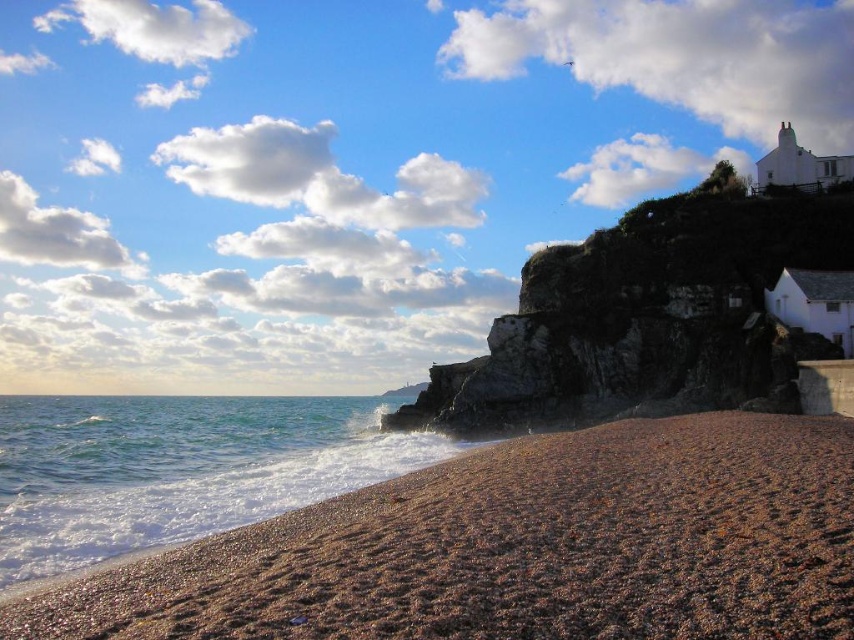
In the scene shown: You are standing on the pebble beach and want to climb up to the rugged stone cliff at upper right. The clear water at lower left is nearby. Which object is higher in elevation?

The rugged stone cliff at upper right is taller than the clear water at lower left, so the rugged stone cliff at upper right is higher in elevation.

You are standing on the beach and want to take a photo of both the brown gravelly sand at lower left and the rugged stone cliff at upper right. Which area will occupy more of the frame when you position the camera to include both objects?

The rugged stone cliff at upper right will occupy more of the frame because it occupies less space than the brown gravelly sand at lower left.

You are standing on the beach and want to walk towards the clear water at lower left. Which direction should you move relative to the brown gravelly sand at lower left?

Since the brown gravelly sand at lower left is in front of the clear water at lower left, you should move away from the brown gravelly sand at lower left to reach the clear water at lower left.